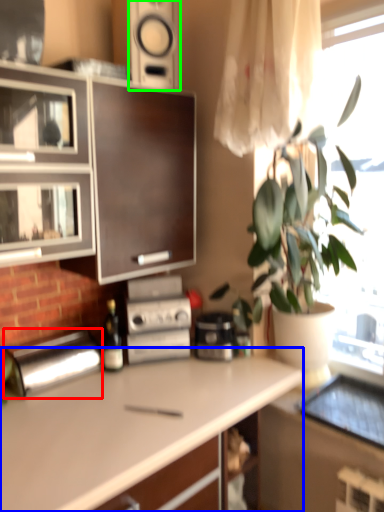
Question: Which object is positioned farthest from appliance (highlighted by a red box)? Select from countertop (highlighted by a blue box) and speaker (highlighted by a green box).

Choices:
 (A) countertop
 (B) speaker

Answer: (B)